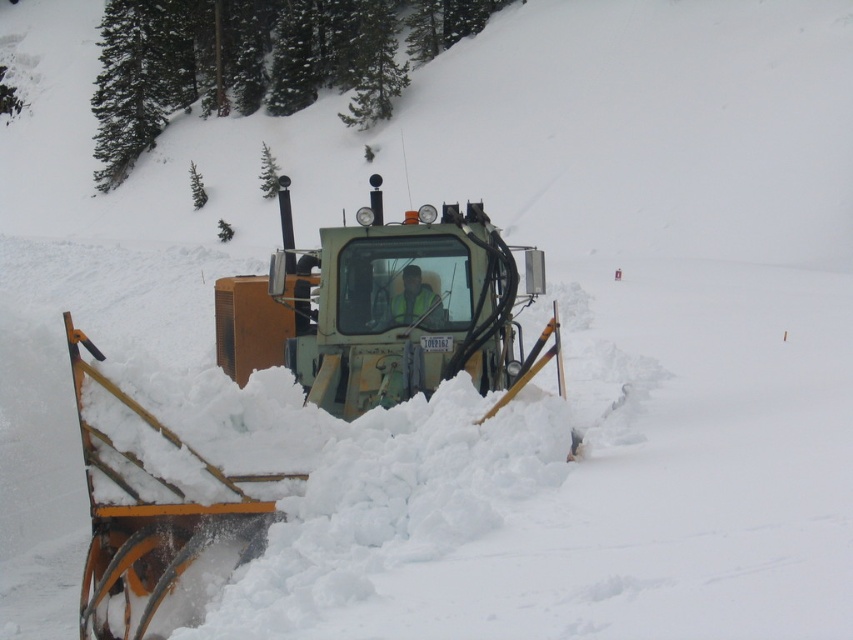
Between green matte snowplow at center and reflective yellow vest at center, which one appears on the right side from the viewer's perspective?

Positioned to the right is reflective yellow vest at center.

The height and width of the screenshot is (640, 853). Find the location of `green matte snowplow at center`. green matte snowplow at center is located at coordinates (378, 308).

The height and width of the screenshot is (640, 853). What do you see at coordinates (378, 308) in the screenshot?
I see `green matte snowplow at center` at bounding box center [378, 308].

Image resolution: width=853 pixels, height=640 pixels. What are the coordinates of `green matte snowplow at center` in the screenshot? It's located at (378, 308).